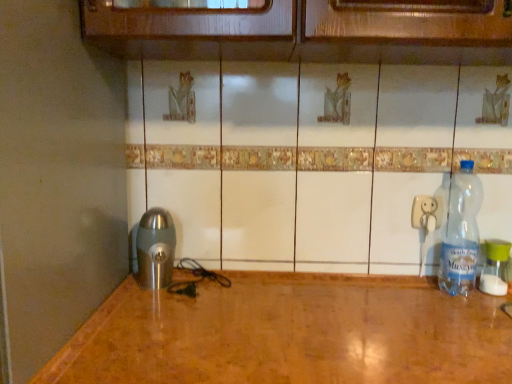
Question: Considering the relative positions of clear plastic bottle at right, which is the 2th bottle from left to right, and brushed metal coffee grinder at lower left in the image provided, is clear plastic bottle at right, which is the 2th bottle from left to right, behind brushed metal coffee grinder at lower left?

Choices:
 (A) yes
 (B) no

Answer: (A)

Question: Is clear plastic bottle at right, the first bottle positioned from the right, wider than brushed metal coffee grinder at lower left?

Choices:
 (A) yes
 (B) no

Answer: (B)

Question: Does clear plastic bottle at right, the first bottle positioned from the right, have a larger size compared to brushed metal coffee grinder at lower left?

Choices:
 (A) no
 (B) yes

Answer: (A)

Question: Can you see clear plastic bottle at right, the first bottle positioned from the right, touching brushed metal coffee grinder at lower left?

Choices:
 (A) yes
 (B) no

Answer: (B)

Question: Would you say clear plastic bottle at right, the first bottle positioned from the right, contains brushed metal coffee grinder at lower left?

Choices:
 (A) no
 (B) yes

Answer: (A)

Question: From a real-world perspective, is clear plastic bottle at right, the first bottle positioned from the right, on top of brushed metal coffee grinder at lower left?

Choices:
 (A) yes
 (B) no

Answer: (B)

Question: Considering the relative sizes of transparent plastic bottle at right, the 1th bottle when ordered from left to right, and clear plastic bottle at right, the first bottle positioned from the right, in the image provided, is transparent plastic bottle at right, the 1th bottle when ordered from left to right, bigger than clear plastic bottle at right, the first bottle positioned from the right,?

Choices:
 (A) no
 (B) yes

Answer: (B)

Question: Could clear plastic bottle at right, which is the 2th bottle from left to right, be considered to be inside transparent plastic bottle at right, the second bottle from the right?

Choices:
 (A) no
 (B) yes

Answer: (A)

Question: Is transparent plastic bottle at right, the second bottle from the right, oriented towards clear plastic bottle at right, which is the 2th bottle from left to right?

Choices:
 (A) no
 (B) yes

Answer: (A)

Question: From a real-world perspective, is transparent plastic bottle at right, the 1th bottle when ordered from left to right, on clear plastic bottle at right, the first bottle positioned from the right?

Choices:
 (A) no
 (B) yes

Answer: (B)

Question: From the image's perspective, is transparent plastic bottle at right, the second bottle from the right, located above clear plastic bottle at right, which is the 2th bottle from left to right?

Choices:
 (A) no
 (B) yes

Answer: (B)

Question: Is transparent plastic bottle at right, the second bottle from the right, positioned with its back to clear plastic bottle at right, which is the 2th bottle from left to right?

Choices:
 (A) no
 (B) yes

Answer: (A)

Question: Is brushed metal coffee grinder at lower left wider than white plastic electric outlet at right?

Choices:
 (A) yes
 (B) no

Answer: (A)